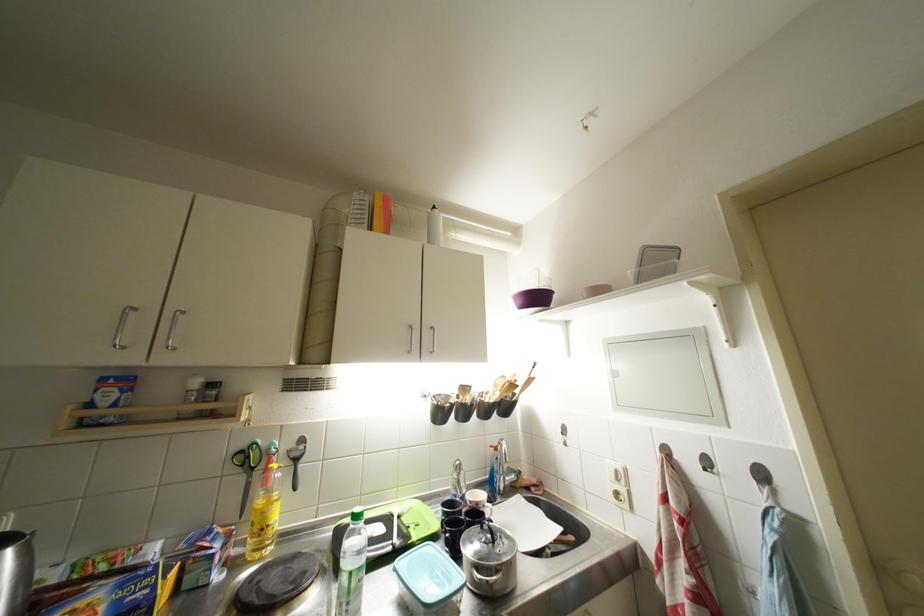
Find where to lift the wooden spatula. Please return your answer as a coordinate pair (x, y).

(525, 385)